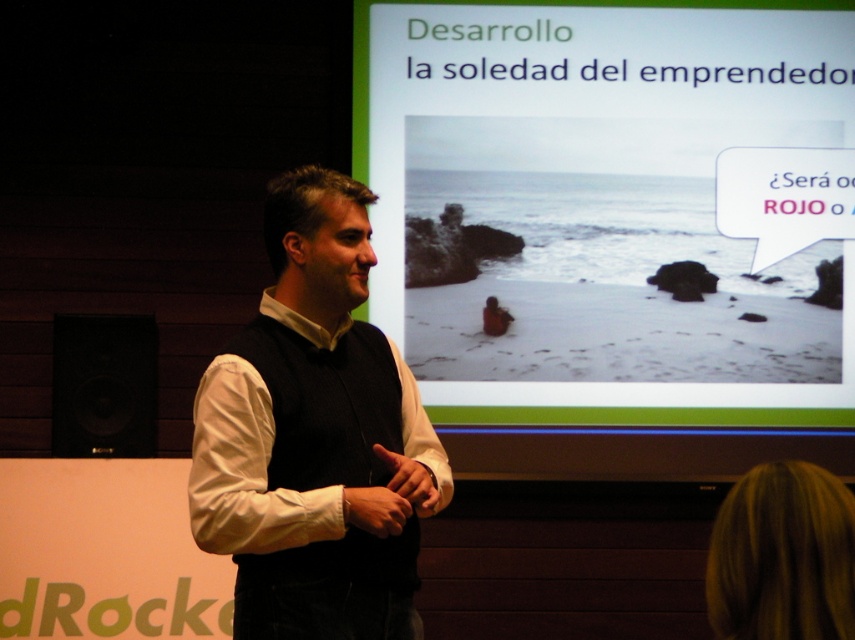
Question: Does white matte vest at center lie in front of black matte speaker at lower left?

Choices:
 (A) yes
 (B) no

Answer: (A)

Question: Which of the following is the closest to the observer?

Choices:
 (A) black matte speaker at lower left
 (B) matte plastic screen at upper center

Answer: (A)

Question: Is white matte vest at center bigger than black matte speaker at lower left?

Choices:
 (A) yes
 (B) no

Answer: (A)

Question: Which of the following is the farthest from the observer?

Choices:
 (A) (429, 324)
 (B) (68, 387)
 (C) (311, 557)

Answer: (A)

Question: Does matte plastic screen at upper center come in front of white matte vest at center?

Choices:
 (A) yes
 (B) no

Answer: (B)

Question: Which object is positioned farthest from the white matte vest at center?

Choices:
 (A) matte plastic screen at upper center
 (B) black matte speaker at lower left

Answer: (B)